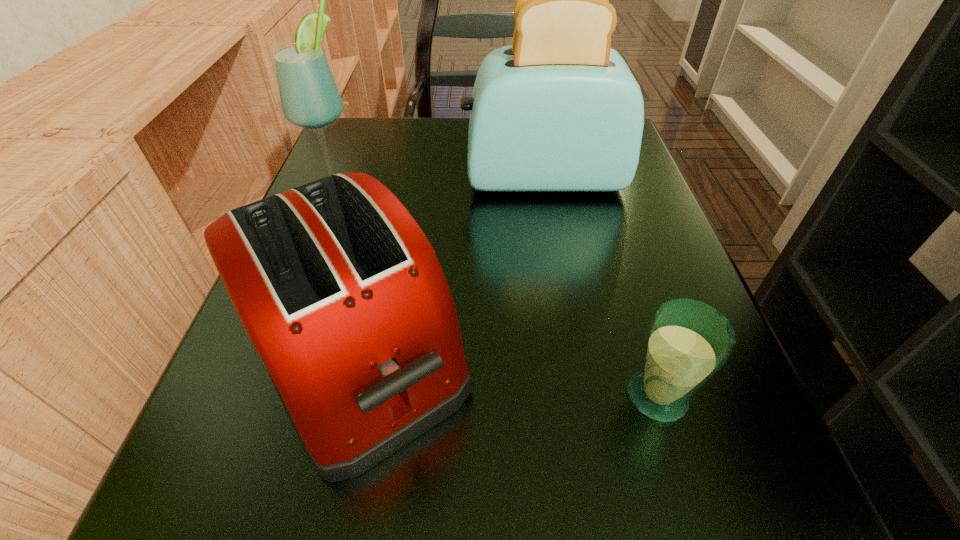
Locate an element on the screen. the farther toaster is located at coordinates point(558,110).

At what (x,y) coordinates should I click in order to perform the action: click on alcohol. Please return your answer as a coordinate pair (x, y). The width and height of the screenshot is (960, 540). Looking at the image, I should click on (309, 97).

Identify the location of the shorter toaster. (339, 290).

Identify the location of the third tallest object. The height and width of the screenshot is (540, 960). (339, 290).

I want to click on the shortest object, so click(688, 341).

Locate an element on the screen. This screenshot has height=540, width=960. blank space located 0.230m on the side of the farther toaster with the lever is located at coordinates (341, 178).

Where is `free region located 0.120m on the side of the farther toaster with the lever`? The height and width of the screenshot is (540, 960). free region located 0.120m on the side of the farther toaster with the lever is located at coordinates (399, 178).

Find the location of a particular element. This screenshot has width=960, height=540. free space located 0.180m on the side of the farther toaster with the lever is located at coordinates [368, 178].

Image resolution: width=960 pixels, height=540 pixels. I want to click on free spot located 0.230m on the right of the alcohol, so click(x=492, y=188).

Find the location of a particular element. This screenshot has width=960, height=540. vacant space located on the right of the shorter toaster is located at coordinates (561, 355).